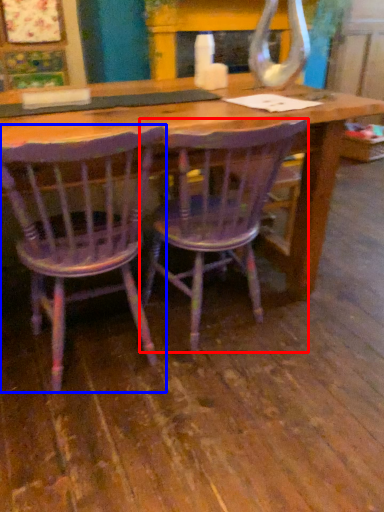
Question: Which object appears farthest to the camera in this image, chair (highlighted by a red box) or chair (highlighted by a blue box)?

Choices:
 (A) chair
 (B) chair

Answer: (A)